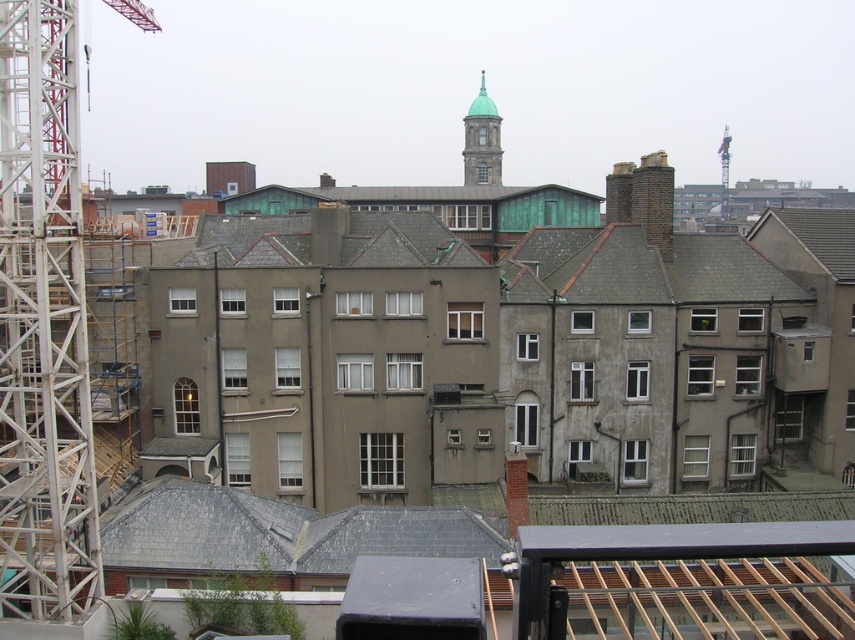
Question: From the image, what is the correct spatial relationship of white metal crane at left in relation to green copper bell tower at upper center?

Choices:
 (A) above
 (B) below

Answer: (B)

Question: Where is white metal crane at left located in relation to green copper bell tower at upper center in the image?

Choices:
 (A) below
 (B) above

Answer: (A)

Question: Which object appears closest to the camera in this image?

Choices:
 (A) green copper bell tower at upper center
 (B) white metal crane at left

Answer: (B)

Question: Does white metal crane at left appear on the left side of green copper bell tower at upper center?

Choices:
 (A) yes
 (B) no

Answer: (A)

Question: Which of the following is the closest to the observer?

Choices:
 (A) green copper bell tower at upper center
 (B) white metal crane at left

Answer: (B)